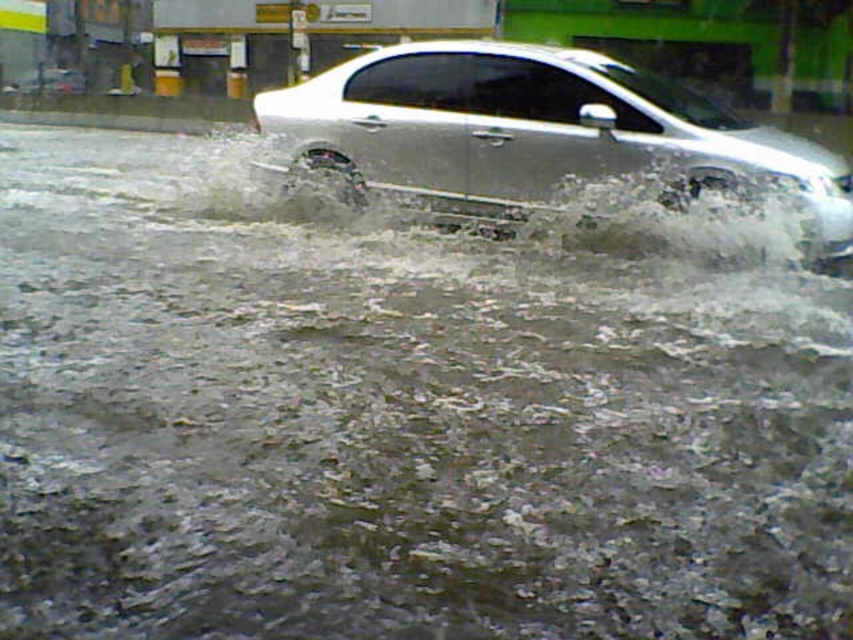
Looking at this image, you are a driver trying to navigate through a flooded street. You see a silver metallic car at center and a satin silver sedan at center. Which vehicle has a wider body to potentially handle deeper water better?

The silver metallic car at center has a wider body than the satin silver sedan at center, so it might handle deeper water better due to its greater width.

You are a rescue worker trying to assess the situation. You see a silver metallic car at center and a satin silver sedan at center in the flooded street. Which vehicle is more likely to stay afloat longer? Explain your reasoning based on their sizes.

The silver metallic car at center is taller than the satin silver sedan at center. Taller vehicles generally have better buoyancy in deep water, so the silver metallic car at center would likely stay afloat longer.

Based on the photo, you are a driver trying to navigate through the flooded street shown in the image. You see a point marked at coordinates (537, 125). What object is located at that point?

The point at coordinates (537, 125) marks the silver metallic car at center.